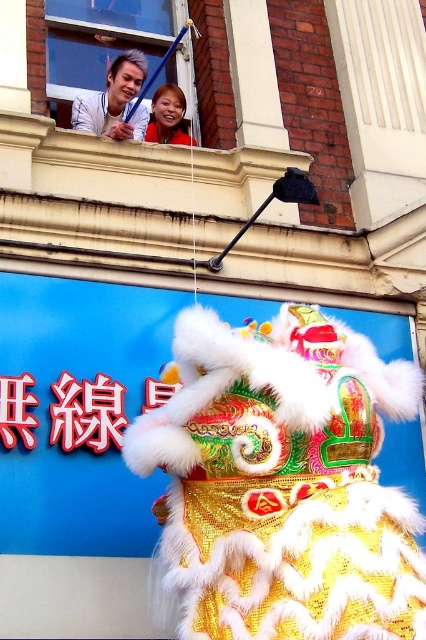
You are a photographer trying to capture the lion dance performance. You notice the matte white shirt at upper left and the smooth skin face at upper center in your frame. Which object should you adjust your camera angle to focus on if you want to highlight the subject behind the other?

The matte white shirt at upper left is in front of the smooth skin face at upper center. To highlight the subject behind, you should adjust your camera angle to focus on the smooth skin face at upper center by moving the matte white shirt at upper left out of the way.